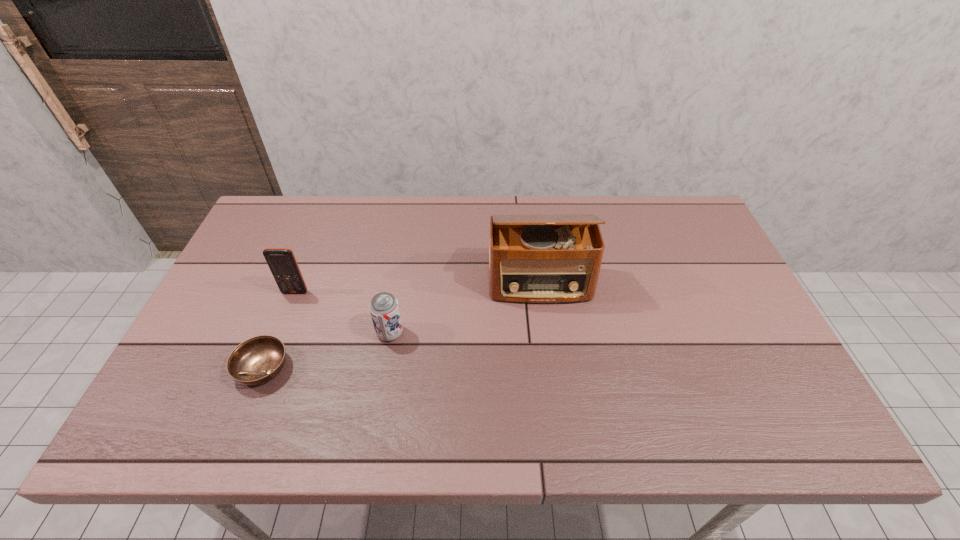
Locate an element on the screen. The width and height of the screenshot is (960, 540). free spot located 0.090m on the back of the nearest object is located at coordinates (282, 318).

The image size is (960, 540). What are the coordinates of `object present at the left edge` in the screenshot? It's located at (257, 360).

Where is `vacant space at the far edge of the desktop`? This screenshot has height=540, width=960. vacant space at the far edge of the desktop is located at coordinates (489, 196).

Identify the location of free point at the left edge. (269, 273).

Where is `vacant area at the right edge of the desktop`? vacant area at the right edge of the desktop is located at coordinates (715, 248).

Where is `vacant space at the far left corner of the desktop`? Image resolution: width=960 pixels, height=540 pixels. vacant space at the far left corner of the desktop is located at coordinates (280, 241).

Where is `free space at the near left corner of the desktop`? free space at the near left corner of the desktop is located at coordinates (189, 429).

In the image, there is a desktop. Where is `vacant area at the far right corner`? This screenshot has height=540, width=960. vacant area at the far right corner is located at coordinates (676, 237).

Locate an element on the screen. This screenshot has height=540, width=960. vacant area that lies between the shortest object and the cellular telephone is located at coordinates (279, 330).

Where is `free area in between the tallest object and the third shortest object`? Image resolution: width=960 pixels, height=540 pixels. free area in between the tallest object and the third shortest object is located at coordinates (418, 288).